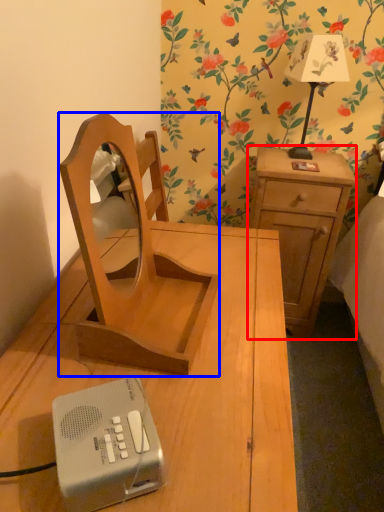
Question: Which object is closer to the camera taking this photo, nightstand (highlighted by a red box) or furniture (highlighted by a blue box)?

Choices:
 (A) nightstand
 (B) furniture

Answer: (B)